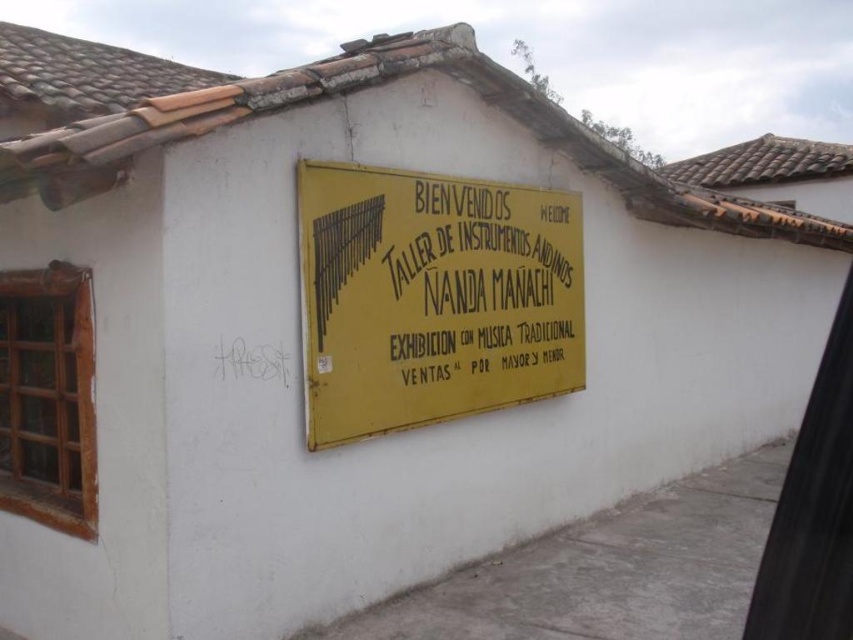
Is yellow matte sign at center positioned in front of yellow paper sign at center?

That is True.

Which is behind, point (375, 385) or point (583, 356)?

The point (583, 356) is behind.

The height and width of the screenshot is (640, 853). In order to click on yellow matte sign at center in this screenshot , I will do `click(432, 298)`.

Where is `yellow matte sign at center`? This screenshot has width=853, height=640. yellow matte sign at center is located at coordinates (432, 298).